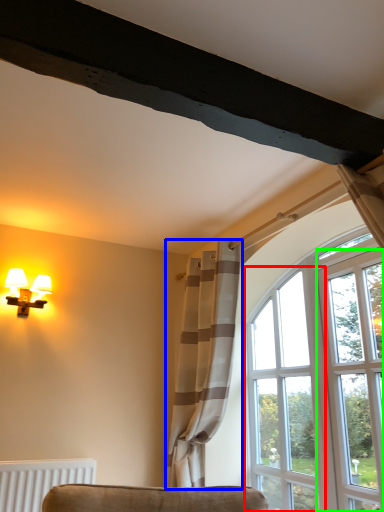
Question: Considering the real-world distances, which object is farthest from window (highlighted by a red box)? curtain (highlighted by a blue box) or screen door (highlighted by a green box)?

Choices:
 (A) curtain
 (B) screen door

Answer: (A)